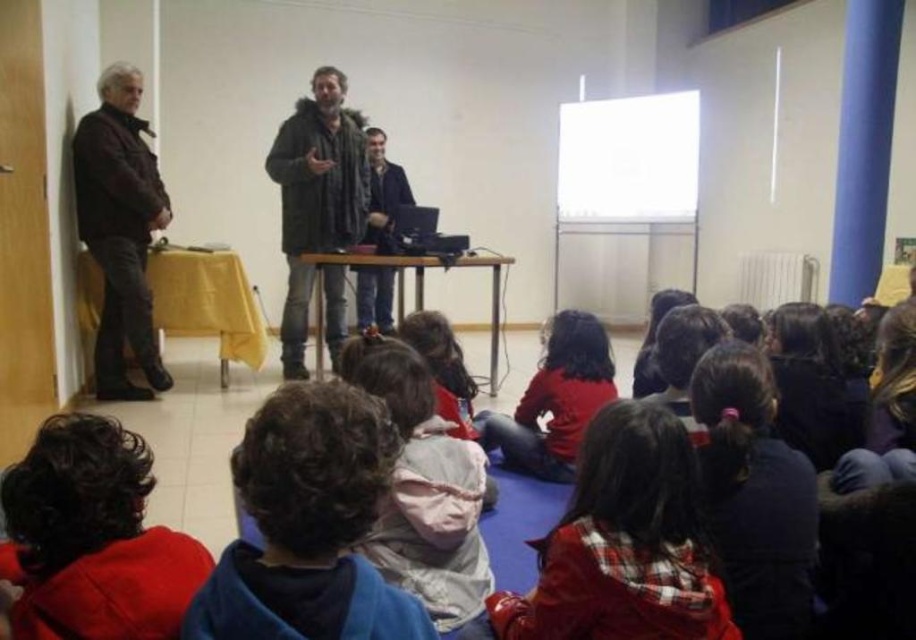
You are a photographer standing behind the camera. You want to capture a closeup shot of the dark blue fleece at center without moving the camera. Is the fleece within the camera lens range?

The dark blue fleece at center and camera are 96.22 centimeters apart. Since the fleece is 96.22 centimeters away from the camera, it is within the typical closeup range of most cameras, so yes, it can be captured without moving the camera.

You are a photographer standing at the back of the room. You want to take a photo of both the dark blue fleece at center and the red cotton shirt at center in the same frame. Can you position yourself such that both are fully visible without moving either object? Explain your reasoning.

The dark blue fleece at center and red cotton shirt at center are 2.03 meters apart. Since the photographer is at the back of the room, they can position themselves to capture both objects in the same frame as they are within a reasonable distance apart, allowing the camera lens to include both without needing to move the objects.